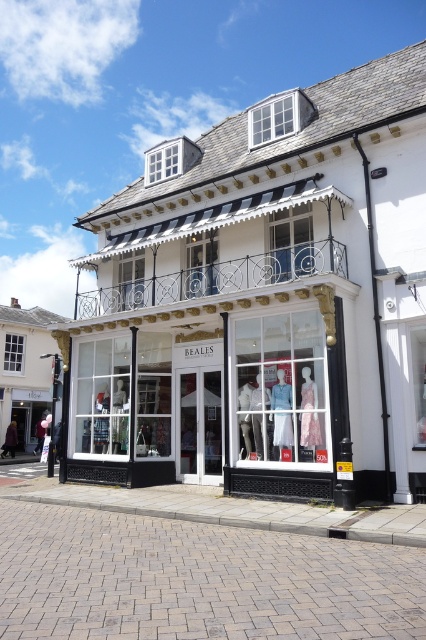
Does point (383, 472) come behind point (284, 323)?

No, (383, 472) is closer to viewer.

Describe the element at coordinates (262, 300) in the screenshot. I see `white glass storefront at center` at that location.

This screenshot has width=426, height=640. What do you see at coordinates (262, 300) in the screenshot?
I see `white glass storefront at center` at bounding box center [262, 300].

Identify the location of white glass storefront at center. (262, 300).